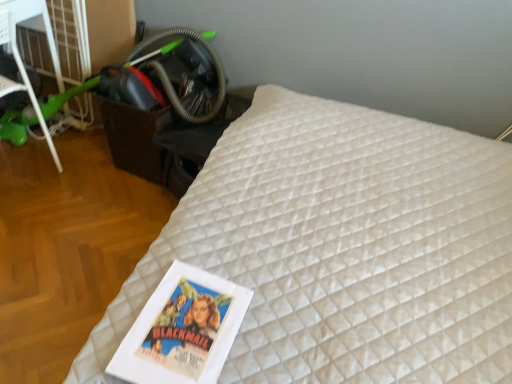
Question: Does black plastic table at lower left have a greater width compared to green plastic scooter at left?

Choices:
 (A) no
 (B) yes

Answer: (B)

Question: Is black plastic table at lower left beside green plastic scooter at left?

Choices:
 (A) yes
 (B) no

Answer: (B)

Question: Is black plastic table at lower left closer to the viewer compared to green plastic scooter at left?

Choices:
 (A) no
 (B) yes

Answer: (A)

Question: Is black plastic table at lower left bigger than green plastic scooter at left?

Choices:
 (A) yes
 (B) no

Answer: (B)

Question: Does black plastic table at lower left have a lesser height compared to green plastic scooter at left?

Choices:
 (A) yes
 (B) no

Answer: (A)

Question: From the image's perspective, is black plastic table at lower left over green plastic scooter at left?

Choices:
 (A) yes
 (B) no

Answer: (B)

Question: Is white quilted mattress at center outside of green plastic scooter at left?

Choices:
 (A) no
 (B) yes

Answer: (B)

Question: Is white quilted mattress at center at the right side of green plastic scooter at left?

Choices:
 (A) no
 (B) yes

Answer: (B)

Question: Is white quilted mattress at center oriented away from green plastic scooter at left?

Choices:
 (A) yes
 (B) no

Answer: (B)

Question: Is white quilted mattress at center smaller than green plastic scooter at left?

Choices:
 (A) no
 (B) yes

Answer: (A)

Question: From a real-world perspective, is white quilted mattress at center over green plastic scooter at left?

Choices:
 (A) yes
 (B) no

Answer: (B)

Question: Is white quilted mattress at center further to the viewer compared to green plastic scooter at left?

Choices:
 (A) yes
 (B) no

Answer: (B)

Question: Is black plastic table at lower left further to camera compared to white quilted mattress at center?

Choices:
 (A) no
 (B) yes

Answer: (B)